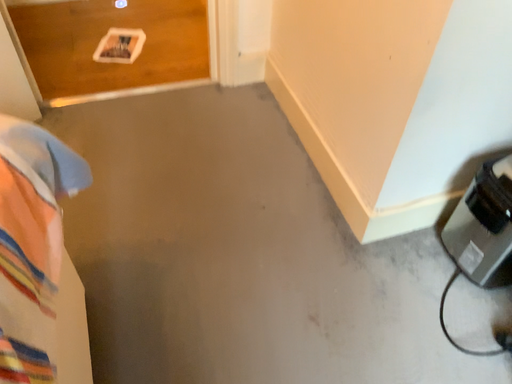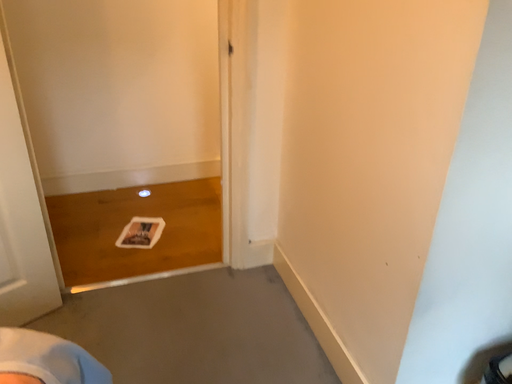
Question: Which way did the camera rotate in the video?

Choices:
 (A) rotated downward
 (B) rotated upward

Answer: (B)